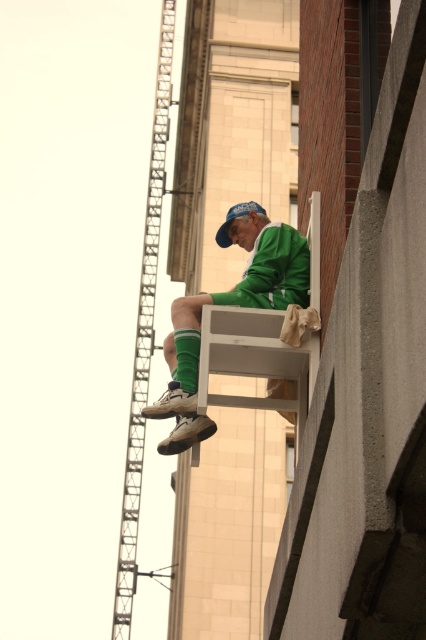
You are a safety inspector reviewing this scene. You notice the green matte jacket at center and the blue fabric cap at center. Which object is positioned closer to the edge of the building?

The green matte jacket at center is closer to the viewer than the blue fabric cap at center, so the green matte jacket at center is positioned closer to the edge of the building.

You are a safety inspector evaluating the scene. You notice the green matte jacket at center and the blue fabric cap at center. According to the safety guidelines, all workers must ensure their safety gear is worn properly. Which item is positioned to the right of the other?

The green matte jacket at center is to the right of the blue fabric cap at center.

You are a safety inspector reviewing this construction site. You notice two points marked on the image. The first point is at coordinate point (x=238, y=291) and the second is at coordinate point (x=218, y=243). Which point is closer to the edge of the building where the man is sitting?

Point (x=238, y=291) is closer to the viewer than point (x=218, y=243), so the first point is closer to the edge of the building where the man is sitting.